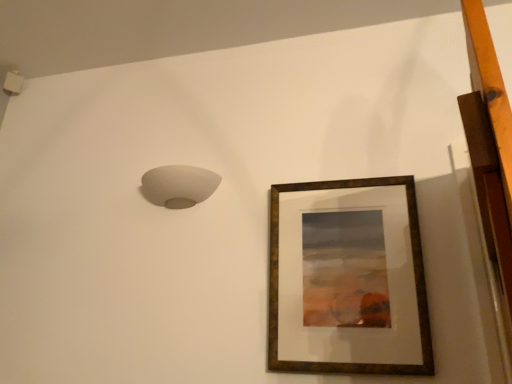
Question: Is brown wooden picture frame at upper right aimed at white matte lampshade at upper left?

Choices:
 (A) yes
 (B) no

Answer: (B)

Question: Is there a large distance between brown wooden picture frame at upper right and white matte lampshade at upper left?

Choices:
 (A) no
 (B) yes

Answer: (A)

Question: Considering the relative sizes of brown wooden picture frame at upper right and white matte lampshade at upper left in the image provided, is brown wooden picture frame at upper right smaller than white matte lampshade at upper left?

Choices:
 (A) no
 (B) yes

Answer: (A)

Question: Is brown wooden picture frame at upper right in contact with white matte lampshade at upper left?

Choices:
 (A) yes
 (B) no

Answer: (B)

Question: Considering the relative sizes of brown wooden picture frame at upper right and white matte lampshade at upper left in the image provided, is brown wooden picture frame at upper right bigger than white matte lampshade at upper left?

Choices:
 (A) yes
 (B) no

Answer: (A)

Question: Does brown wooden picture frame at upper right appear on the right side of white matte lampshade at upper left?

Choices:
 (A) yes
 (B) no

Answer: (A)

Question: From a real-world perspective, is white matte lampshade at upper left physically above brown wooden picture frame at upper right?

Choices:
 (A) no
 (B) yes

Answer: (B)

Question: Is white matte lampshade at upper left placed right next to brown wooden picture frame at upper right?

Choices:
 (A) no
 (B) yes

Answer: (A)

Question: Is white matte lampshade at upper left oriented away from brown wooden picture frame at upper right?

Choices:
 (A) yes
 (B) no

Answer: (B)

Question: From a real-world perspective, does white matte lampshade at upper left sit lower than brown wooden picture frame at upper right?

Choices:
 (A) no
 (B) yes

Answer: (A)

Question: Could you tell me if white matte lampshade at upper left is facing brown wooden picture frame at upper right?

Choices:
 (A) yes
 (B) no

Answer: (B)

Question: Considering the relative positions of white matte lampshade at upper left and brown wooden picture frame at upper right in the image provided, is white matte lampshade at upper left behind brown wooden picture frame at upper right?

Choices:
 (A) no
 (B) yes

Answer: (B)

Question: From their relative heights in the image, would you say white matte lampshade at upper left is taller or shorter than brown wooden picture frame at upper right?

Choices:
 (A) tall
 (B) short

Answer: (B)